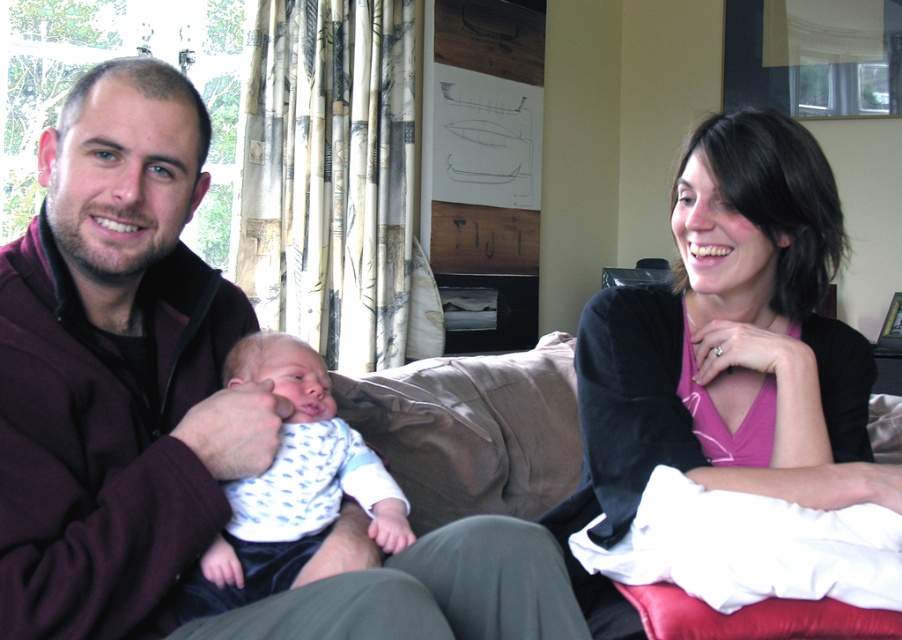
Question: Is maroon fleece jacket at left above pink matte shirt at center?

Choices:
 (A) yes
 (B) no

Answer: (B)

Question: Can you confirm if pink matte shirt at center is positioned below white dotted fabric at center?

Choices:
 (A) no
 (B) yes

Answer: (A)

Question: Which point is closer to the camera taking this photo?

Choices:
 (A) (862, 468)
 (B) (159, 467)

Answer: (B)

Question: Is pink matte shirt at center to the left of white dotted fabric at center from the viewer's perspective?

Choices:
 (A) no
 (B) yes

Answer: (A)

Question: Among these objects, which one is farthest from the camera?

Choices:
 (A) maroon fleece jacket at left
 (B) white dotted fabric at center
 (C) pink matte shirt at center

Answer: (C)

Question: Which object is closer to the camera taking this photo?

Choices:
 (A) maroon fleece jacket at left
 (B) white dotted fabric at center
 (C) pink matte shirt at center

Answer: (A)